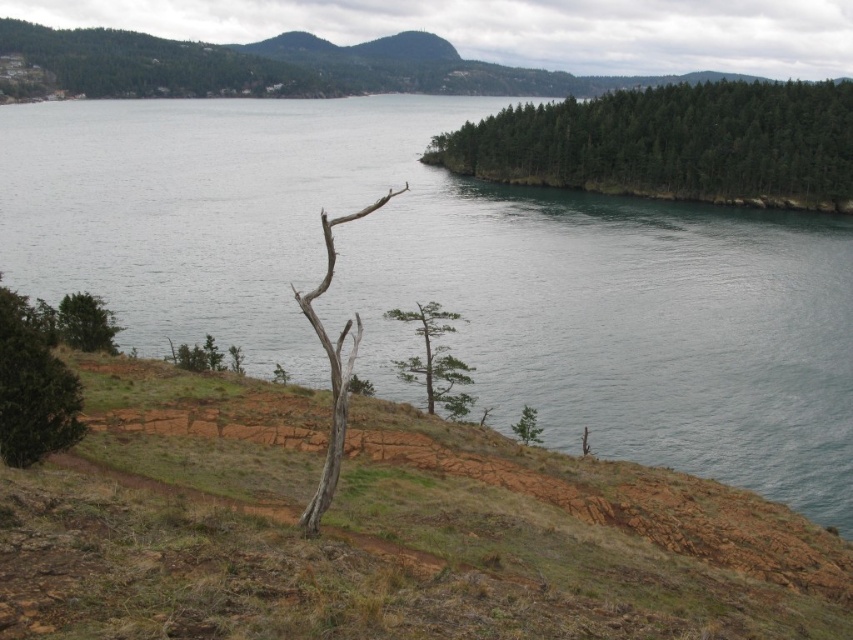
Who is more distant from viewer, (796, 465) or (428, 394)?

The point (796, 465) is behind.

Is greenish-blue water at center above green matte tree at center?

Yes.

Is point (480, 253) in front of point (473, 400)?

No, (480, 253) is behind (473, 400).

Where is `greenish-blue water at center`? The height and width of the screenshot is (640, 853). greenish-blue water at center is located at coordinates (450, 276).

Is green matte forest at upper right to the left of green matte tree at lower right from the viewer's perspective?

No, green matte forest at upper right is not to the left of green matte tree at lower right.

Which is below, green matte forest at upper right or green matte tree at lower right?

green matte tree at lower right is lower down.

What do you see at coordinates (672, 144) in the screenshot?
I see `green matte forest at upper right` at bounding box center [672, 144].

I want to click on green matte forest at upper right, so click(672, 144).

Is point (68, 440) in front of point (521, 428)?

That is True.

Does green matte bush at left have a lesser width compared to green matte tree at lower right?

Incorrect, green matte bush at left's width is not less than green matte tree at lower right's.

The width and height of the screenshot is (853, 640). What do you see at coordinates (33, 388) in the screenshot?
I see `green matte bush at left` at bounding box center [33, 388].

Identify the location of green matte bush at left. (33, 388).